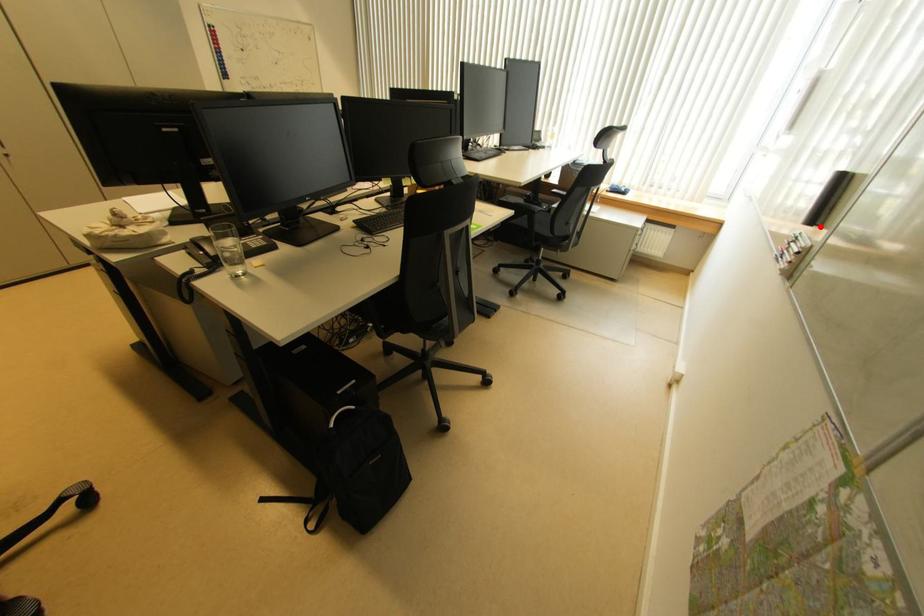
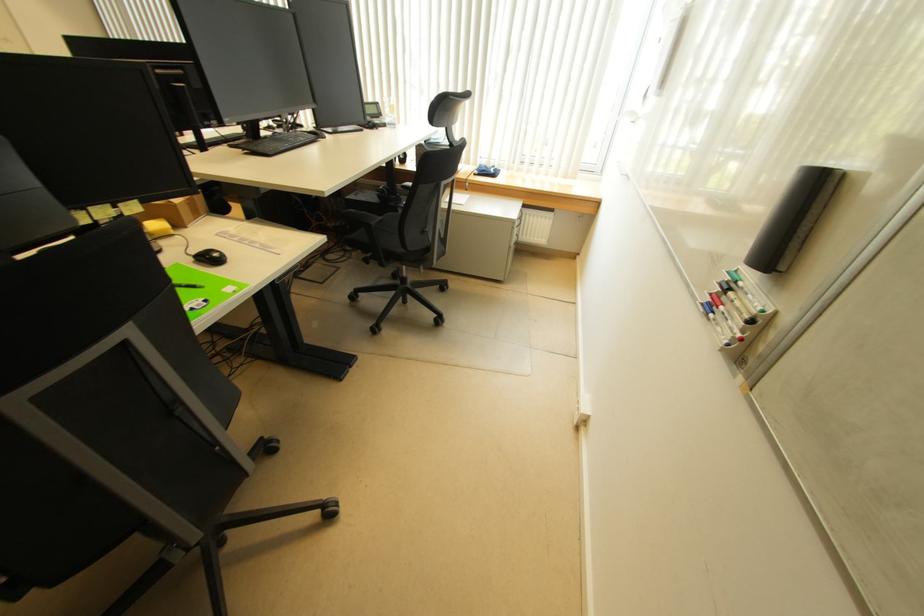
Question: I am providing you with two images of the same scene from different viewpoints. A red point is shown in image1. For the corresponding object point in image2, is it positioned nearer or farther from the camera?

Choices:
 (A) Nearer
 (B) Farther

Answer: (B)